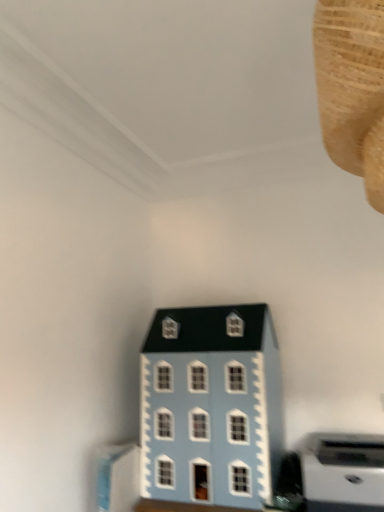
Question: Should I look upward or downward to see light blue plastic toy house at lower center?

Choices:
 (A) down
 (B) up

Answer: (A)